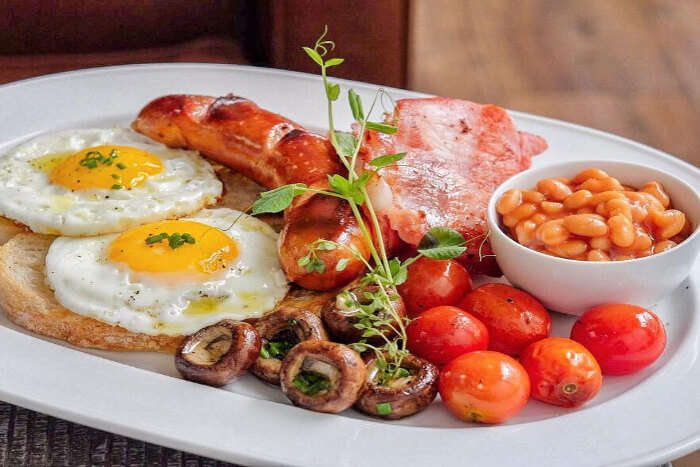
This screenshot has height=467, width=700. In order to click on light gray bowl in this screenshot , I will do `click(591, 282)`.